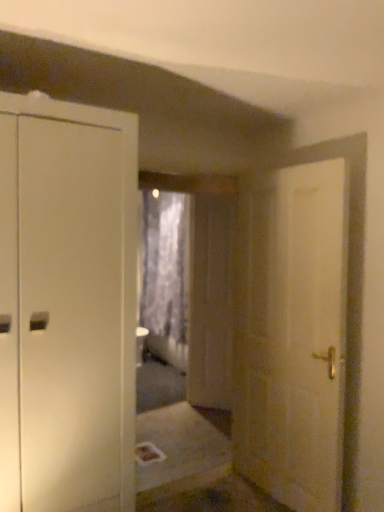
Question: Does point (228, 407) appear closer or farther from the camera than point (187, 230)?

Choices:
 (A) closer
 (B) farther

Answer: (A)

Question: Based on their sizes in the image, would you say transparent plastic screen door at center is bigger or smaller than gray textured curtain at center?

Choices:
 (A) small
 (B) big

Answer: (A)

Question: Which object is positioned closest to the white matte door at right?

Choices:
 (A) gray textured curtain at center
 (B) transparent plastic screen door at center

Answer: (B)

Question: Considering the real-world distances, which object is farthest from the gray textured curtain at center?

Choices:
 (A) white matte door at right
 (B) transparent plastic screen door at center

Answer: (A)